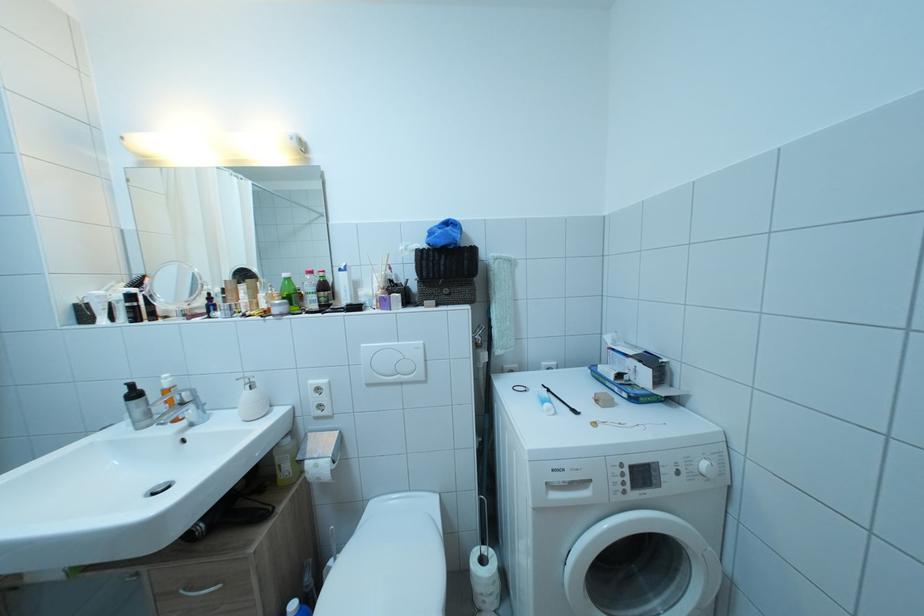
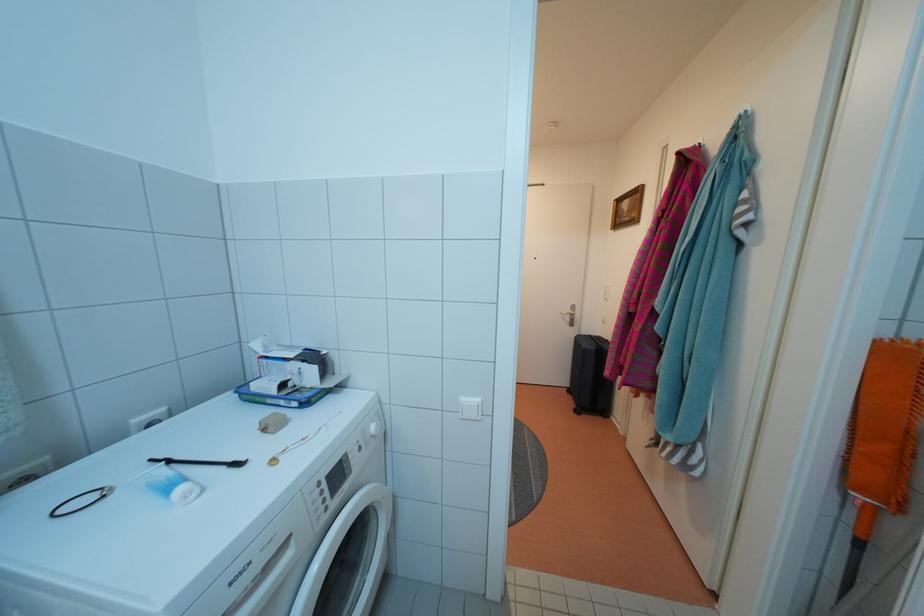
In the second image, find the point that corresponds to (x=711, y=471) in the first image.

(380, 434)